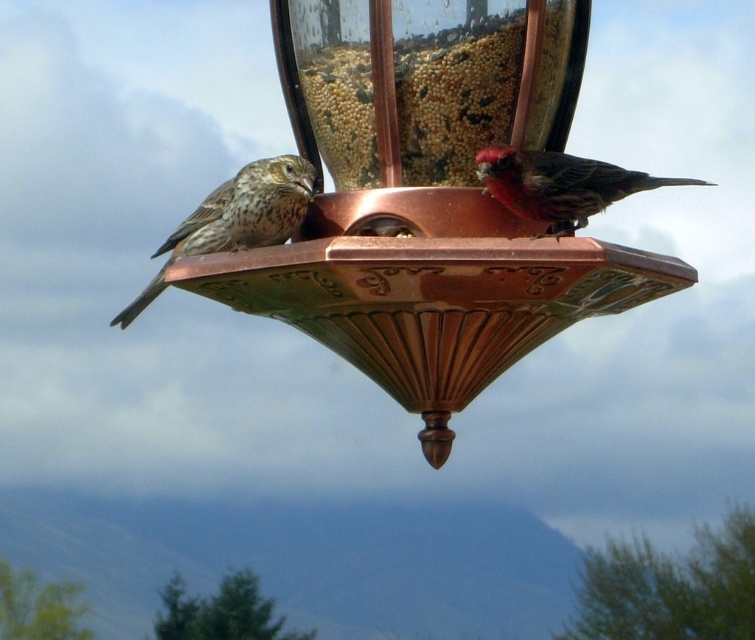
Does copper metallic bird feeder at center lie in front of brown speckled sparrow at left?

Yes, it is in front of brown speckled sparrow at left.

What are the coordinates of `copper metallic bird feeder at center` in the screenshot? It's located at (427, 198).

You are a GUI agent. You are given a task and a screenshot of the screen. Output one action in this format:
    pyautogui.click(x=<x>, y=<y>)
    Task: Click on the copper metallic bird feeder at center
    
    Given the screenshot: What is the action you would take?
    pyautogui.click(x=427, y=198)

Does copper metallic bird feeder at center appear over reddish-brown feathers at upper right?

Actually, copper metallic bird feeder at center is below reddish-brown feathers at upper right.

Is point (356, 291) positioned after point (575, 172)?

That is False.

What are the coordinates of `copper metallic bird feeder at center` in the screenshot? It's located at (427, 198).

Where is `copper metallic bird feeder at center`? Image resolution: width=755 pixels, height=640 pixels. copper metallic bird feeder at center is located at coordinates (427, 198).

Is brown speckled sparrow at left positioned before reddish-brown feathers at upper right?

No, brown speckled sparrow at left is behind reddish-brown feathers at upper right.

Does brown speckled sparrow at left have a larger size compared to reddish-brown feathers at upper right?

No.

Is point (270, 205) farther from viewer compared to point (532, 164)?

Yes.

Locate an element on the screen. The height and width of the screenshot is (640, 755). brown speckled sparrow at left is located at coordinates (236, 218).